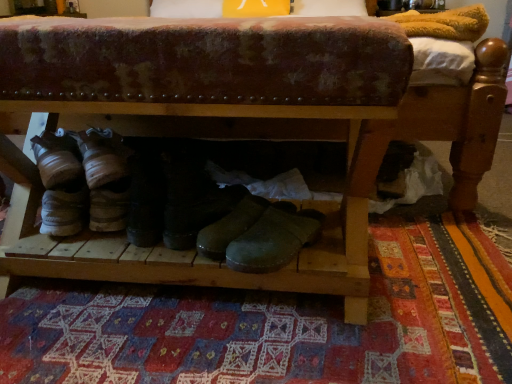
Question: Considering the relative positions of green leather boot at center, which is the 1th footwear from right to left, and black leather boots at center, the 2th footwear in the right-to-left sequence, in the image provided, is green leather boot at center, which is the 1th footwear from right to left, to the left of black leather boots at center, the 2th footwear in the right-to-left sequence, from the viewer's perspective?

Choices:
 (A) yes
 (B) no

Answer: (B)

Question: Is the depth of green leather boot at center, which is the 1th footwear from right to left, greater than that of black leather boots at center, the 2th footwear in the right-to-left sequence?

Choices:
 (A) yes
 (B) no

Answer: (B)

Question: Can you confirm if green leather boot at center, placed as the second footwear when sorted from left to right, is smaller than black leather boots at center, which is the first footwear in left-to-right order?

Choices:
 (A) yes
 (B) no

Answer: (A)

Question: Considering the relative sizes of green leather boot at center, which is the 1th footwear from right to left, and black leather boots at center, which is the first footwear in left-to-right order, in the image provided, is green leather boot at center, which is the 1th footwear from right to left, thinner than black leather boots at center, which is the first footwear in left-to-right order,?

Choices:
 (A) yes
 (B) no

Answer: (B)

Question: Is green leather boot at center, placed as the second footwear when sorted from left to right, closer to the viewer compared to black leather boots at center, the 2th footwear in the right-to-left sequence?

Choices:
 (A) yes
 (B) no

Answer: (A)

Question: Is green leather boot at center, placed as the second footwear when sorted from left to right, to the left or to the right of patchwork rug at center in the image?

Choices:
 (A) left
 (B) right

Answer: (A)

Question: Do you think green leather boot at center, which is the 1th footwear from right to left, is within patchwork rug at center, or outside of it?

Choices:
 (A) outside
 (B) inside

Answer: (A)

Question: From a real-world perspective, is green leather boot at center, which is the 1th footwear from right to left, positioned above or below patchwork rug at center?

Choices:
 (A) above
 (B) below

Answer: (A)

Question: In the image, is green leather boot at center, which is the 1th footwear from right to left, positioned in front of or behind patchwork rug at center?

Choices:
 (A) front
 (B) behind

Answer: (B)

Question: Would you say black leather boots at center, which is the first footwear in left-to-right order, is inside or outside patchwork rug at center?

Choices:
 (A) outside
 (B) inside

Answer: (A)

Question: From a real-world perspective, is black leather boots at center, which is the first footwear in left-to-right order, positioned above or below patchwork rug at center?

Choices:
 (A) below
 (B) above

Answer: (B)

Question: From their relative heights in the image, would you say black leather boots at center, which is the first footwear in left-to-right order, is taller or shorter than patchwork rug at center?

Choices:
 (A) tall
 (B) short

Answer: (A)

Question: Looking at their shapes, would you say black leather boots at center, the 2th footwear in the right-to-left sequence, is wider or thinner than patchwork rug at center?

Choices:
 (A) thin
 (B) wide

Answer: (A)

Question: Considering the positions of black leather boots at center, the 2th footwear in the right-to-left sequence, and green leather boot at center, placed as the second footwear when sorted from left to right, in the image, is black leather boots at center, the 2th footwear in the right-to-left sequence, wider or thinner than green leather boot at center, placed as the second footwear when sorted from left to right,?

Choices:
 (A) thin
 (B) wide

Answer: (A)

Question: From the image's perspective, relative to green leather boot at center, which is the 1th footwear from right to left, is black leather boots at center, the 2th footwear in the right-to-left sequence, above or below?

Choices:
 (A) above
 (B) below

Answer: (A)